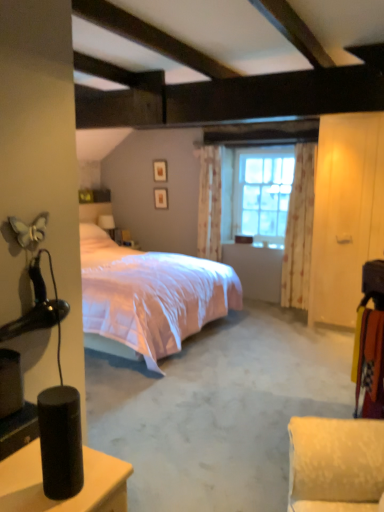
Question: Considering the positions of point (301, 258) and point (152, 163), is point (301, 258) closer or farther from the camera than point (152, 163)?

Choices:
 (A) closer
 (B) farther

Answer: (A)

Question: From a real-world perspective, is floral fabric curtain at right, the 1th curtain from the front, above or below matte wooden picture frame at upper center, placed as the 1th picture frame when sorted from top to bottom?

Choices:
 (A) below
 (B) above

Answer: (A)

Question: Considering the real-world distances, which object is closest to the floral fabric curtain at right, the 1th curtain from the front?

Choices:
 (A) pink satin bed at center
 (B) matte wooden picture frame at upper center, placed as the 1th picture frame when sorted from top to bottom
 (C) matte wooden picture frame at upper center, which ranks as the 2th picture frame in top-to-bottom order
 (D) clear glass window at center
 (E) matte white table lamp at center

Answer: (D)

Question: Estimate the real-world distances between objects in this image. Which object is farther from the floral fabric curtain at center, arranged as the 1th curtain when viewed from the back?

Choices:
 (A) matte wooden picture frame at upper center, which ranks as the first picture frame in bottom-to-top order
 (B) matte white table lamp at center
 (C) pink satin bed at center
 (D) clear glass window at center
 (E) matte wooden picture frame at upper center, placed as the 1th picture frame when sorted from top to bottom

Answer: (B)